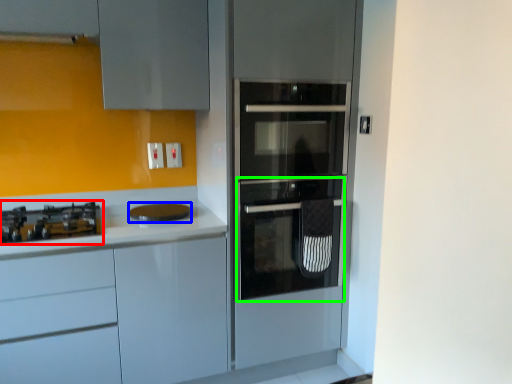
Question: Which is nearer to the gas stove (highlighted by a red box)? home appliance (highlighted by a blue box) or oven (highlighted by a green box).

Choices:
 (A) home appliance
 (B) oven

Answer: (A)